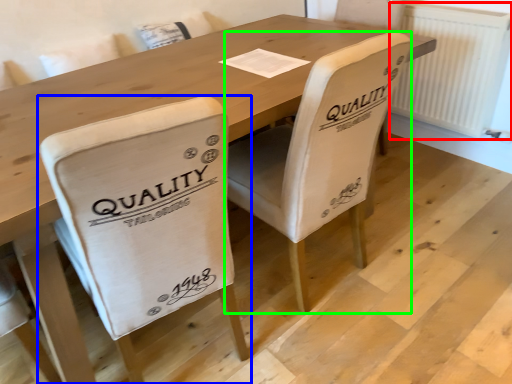
Question: Which object is the farthest from radiator (highlighted by a red box)? Choose among these: chair (highlighted by a blue box) or chair (highlighted by a green box).

Choices:
 (A) chair
 (B) chair

Answer: (A)